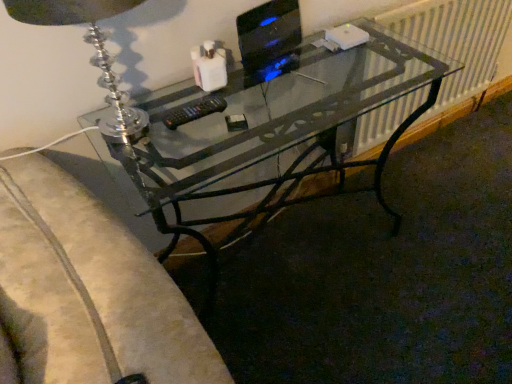
Where is `vacant space to the right of black plastic remote at center`? vacant space to the right of black plastic remote at center is located at coordinates (271, 98).